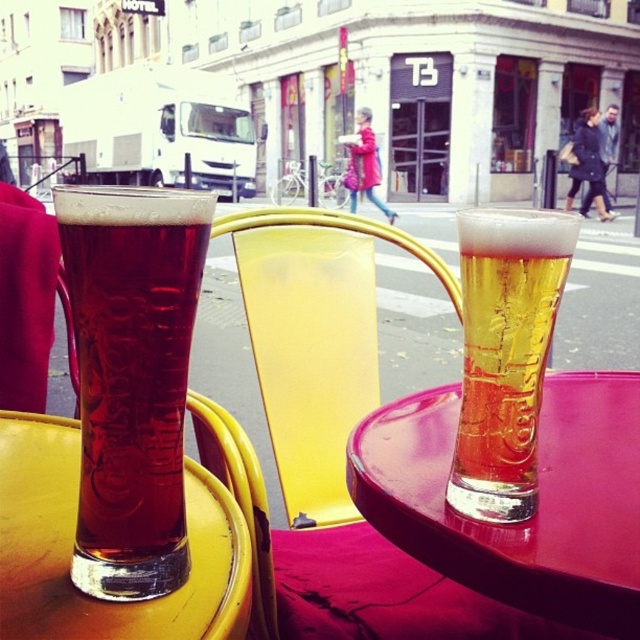
Question: Does dark amber glass at left appear under yellow plastic chair at center?

Choices:
 (A) no
 (B) yes

Answer: (A)

Question: Is translucent glass beer at center to the left of translucent glass at lower left from the viewer's perspective?

Choices:
 (A) no
 (B) yes

Answer: (A)

Question: Based on their relative distances, which object is nearer to the translucent glass beer at center?

Choices:
 (A) translucent amber glass at right
 (B) dark amber glass at left
 (C) yellow plastic chair at center
 (D) translucent glass at lower left

Answer: (A)

Question: Which point appears farthest from the camera in this image?

Choices:
 (A) (497, 557)
 (B) (317, 273)

Answer: (B)

Question: Which of these objects is positioned closest to the dark blue coat at upper right?

Choices:
 (A) yellow plastic chair at center
 (B) dark amber glass at left
 (C) translucent glass at lower left

Answer: (A)

Question: Is yellow plastic chair at center to the right of translucent amber glass at right from the viewer's perspective?

Choices:
 (A) no
 (B) yes

Answer: (A)